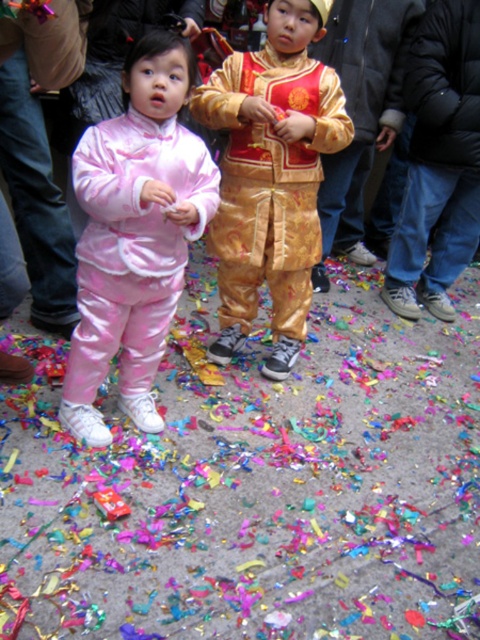
This screenshot has height=640, width=480. What do you see at coordinates (134, 234) in the screenshot?
I see `pink satin outfit at center` at bounding box center [134, 234].

You are a GUI agent. You are given a task and a screenshot of the screen. Output one action in this format:
    pyautogui.click(x=<x>, y=<y>)
    Task: Click on the pink satin outfit at center
    
    Given the screenshot: What is the action you would take?
    pyautogui.click(x=134, y=234)

What are the coordinates of `pink satin outfit at center` in the screenshot? It's located at (134, 234).